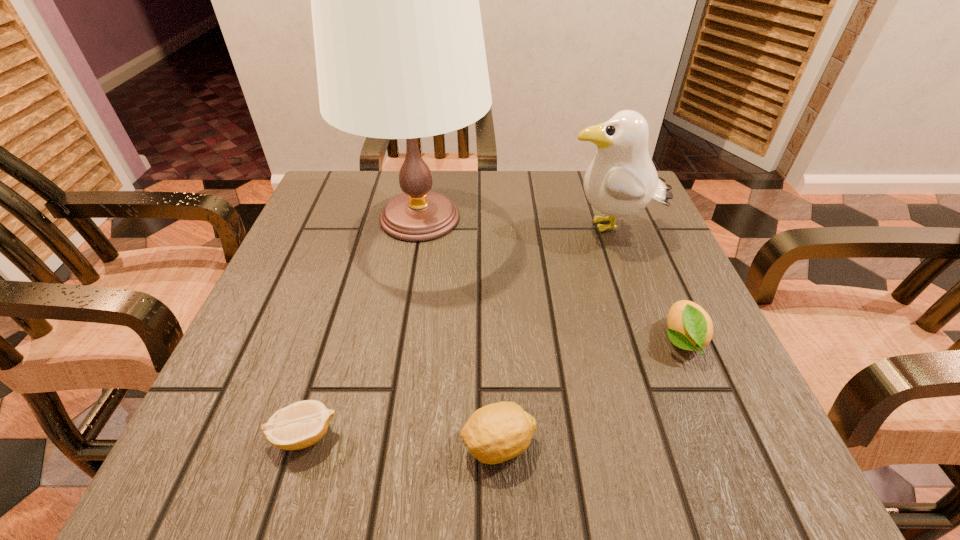
At what (x,y) coordinates should I click in order to perform the action: click on blank area at the near left corner. Please return your answer as a coordinate pair (x, y). The height and width of the screenshot is (540, 960). Looking at the image, I should click on (266, 469).

The width and height of the screenshot is (960, 540). In order to click on blank region between the second lemon from left to right and the third nearest object in this screenshot , I will do `click(590, 393)`.

This screenshot has width=960, height=540. What are the coordinates of `vacant space that's between the fourth shortest object and the rightmost lemon` in the screenshot? It's located at (645, 284).

In order to click on free space that is in between the tallest object and the second tallest object in this screenshot , I will do `click(516, 222)`.

In order to click on free space between the tallest object and the rightmost lemon in this screenshot , I will do coord(551,279).

In order to click on free space between the lamp and the gull in this screenshot , I will do `click(516, 222)`.

You are a GUI agent. You are given a task and a screenshot of the screen. Output one action in this format:
    pyautogui.click(x=<x>, y=<y>)
    Task: Click on the empty space between the farthest lemon and the lamp
    
    Given the screenshot: What is the action you would take?
    pyautogui.click(x=551, y=279)

This screenshot has height=540, width=960. Find the location of `vacant area that lies between the gull and the leftmost lemon`. vacant area that lies between the gull and the leftmost lemon is located at coordinates (457, 332).

Find the location of a particular element. This screenshot has height=540, width=960. vacant area that lies between the leftmost lemon and the rightmost lemon is located at coordinates (492, 388).

Find the location of a particular element. unoccupied position between the leftmost lemon and the second lemon from left to right is located at coordinates (401, 440).